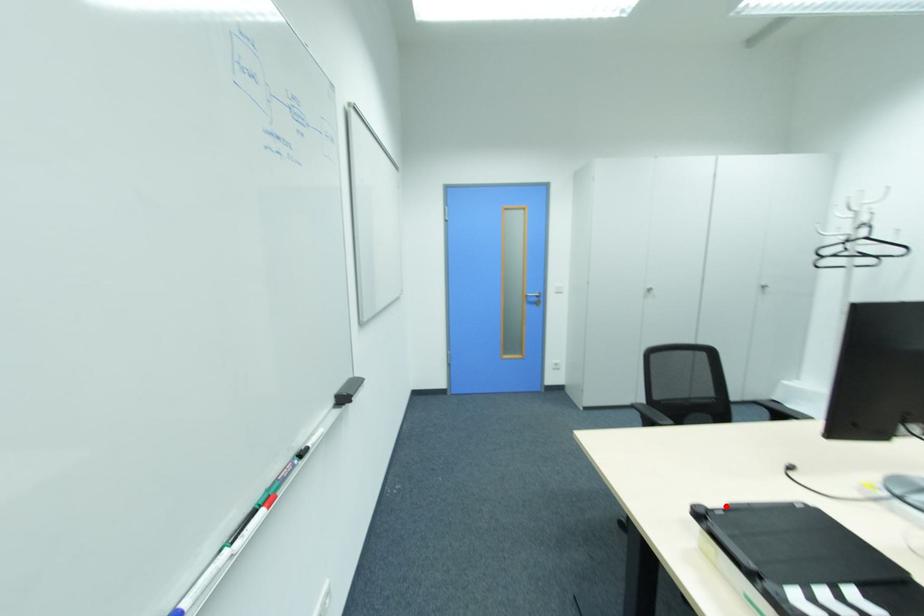
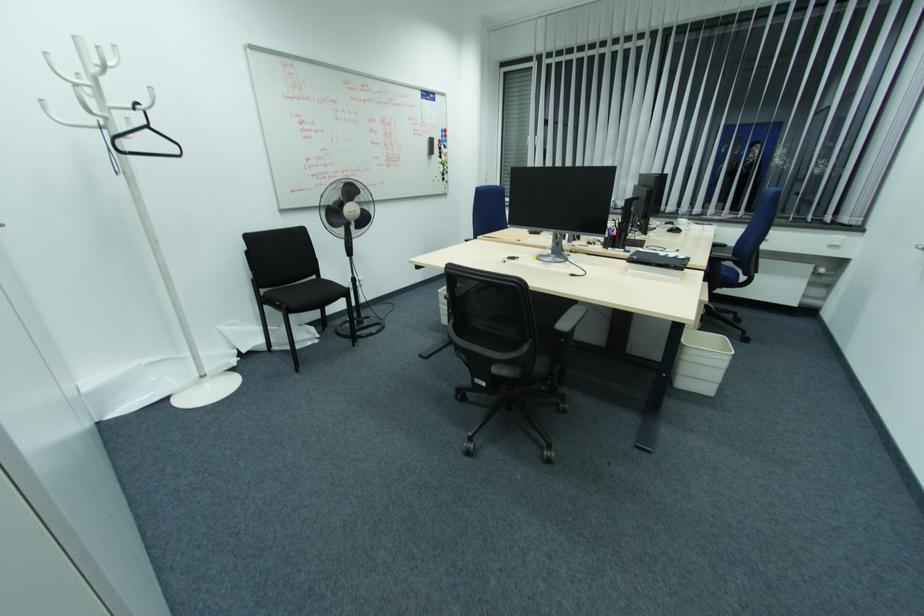
Question: I am providing you with two images of the same scene from different viewpoints. A red point is marked on the first image. Can you still see the location of the red point in image 2?

Choices:
 (A) Yes
 (B) No

Answer: (A)